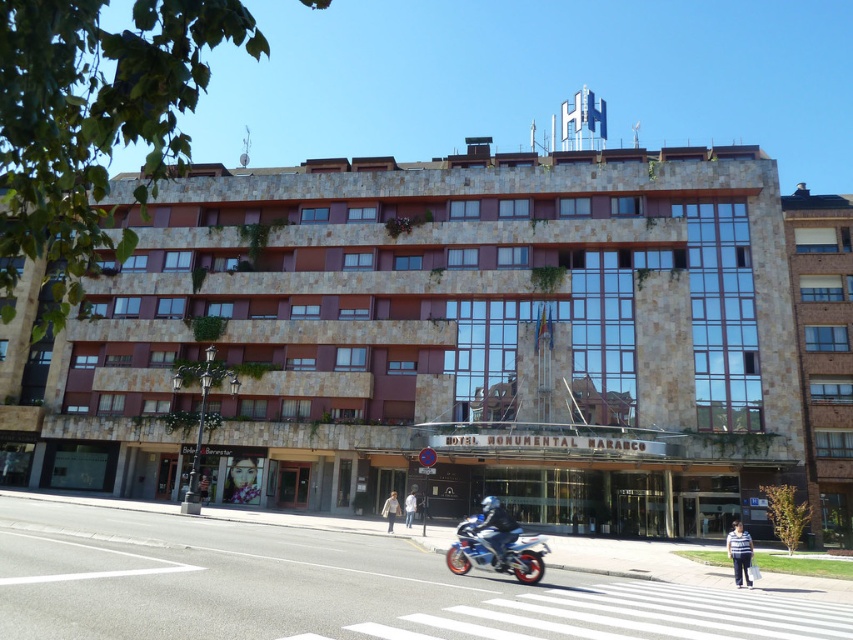
Question: Is metallic blue motorcycle at center above shiny blue motorcycle at center?

Choices:
 (A) yes
 (B) no

Answer: (B)

Question: Is brown stone building at center thinner than light beige jacket at center?

Choices:
 (A) no
 (B) yes

Answer: (A)

Question: Among these points, which one is farthest from the camera?

Choices:
 (A) click(x=732, y=556)
 (B) click(x=738, y=378)
 (C) click(x=830, y=396)

Answer: (C)

Question: Which point is closer to the camera taking this photo?

Choices:
 (A) (473, 541)
 (B) (405, 509)
 (C) (502, 508)
 (D) (735, 580)

Answer: (A)

Question: Can you confirm if metallic blue motorcycle at center is bigger than white cotton shirt at center?

Choices:
 (A) no
 (B) yes

Answer: (B)

Question: Which object is the closest to the metallic blue motorcycle at center?

Choices:
 (A) light beige jacket at center
 (B) white cotton shirt at center
 (C) brown stone building at center
 (D) white striped shirt at lower right

Answer: (A)